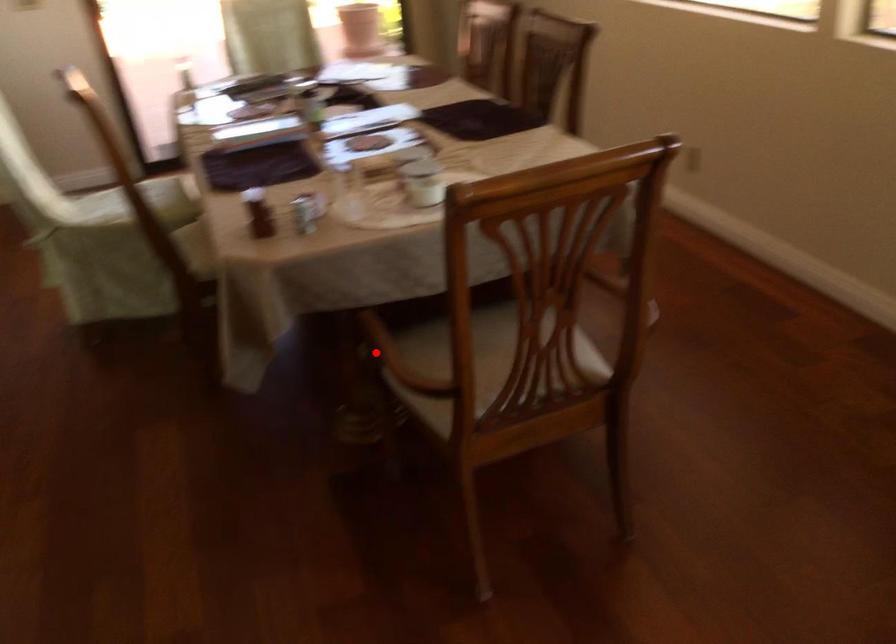
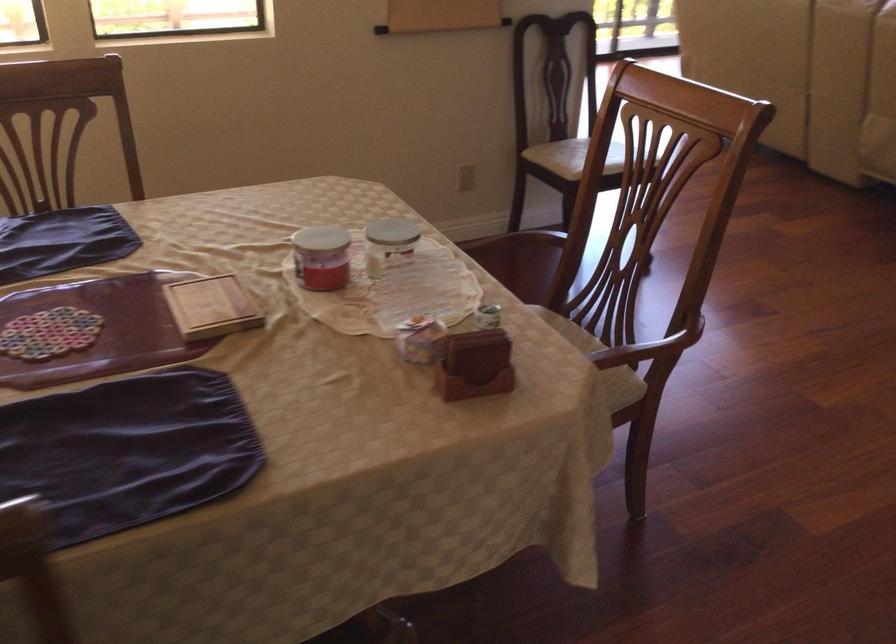
Where in the second image is the point corresponding to the highlighted location from the first image?

(642, 351)